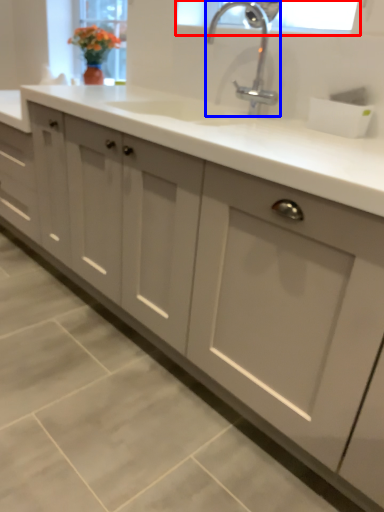
Question: Which of the following is the closest to the observer, window screen (highlighted by a red box) or tap (highlighted by a blue box)?

Choices:
 (A) window screen
 (B) tap

Answer: (B)